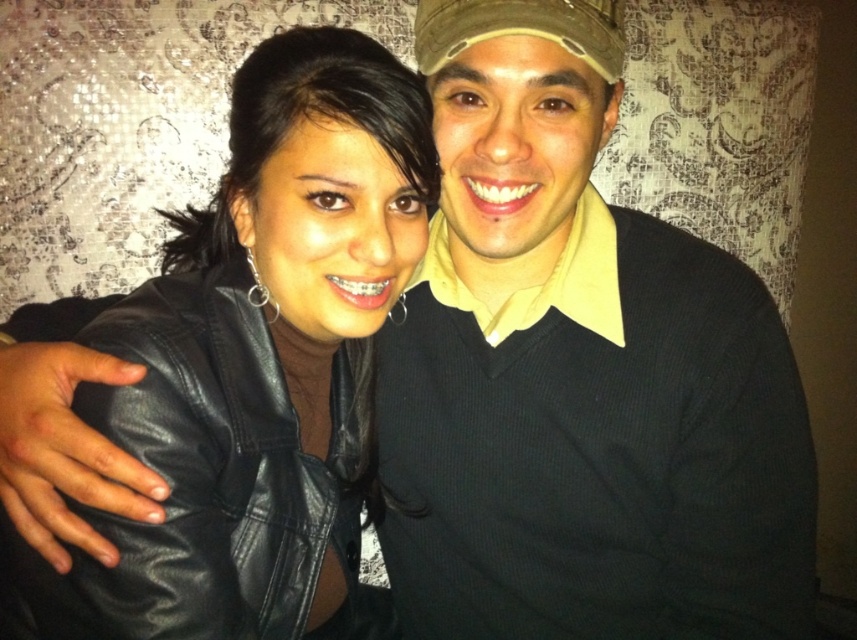
Is black sweater at center positioned before black leather jacket at center?

Yes, it is.

How far apart are black sweater at center and black leather jacket at center?

The distance of black sweater at center from black leather jacket at center is 6.80 inches.

Does point (636, 504) lie in front of point (112, 406)?

No, it is behind (112, 406).

Find the location of a particular element. This screenshot has width=857, height=640. black sweater at center is located at coordinates (579, 374).